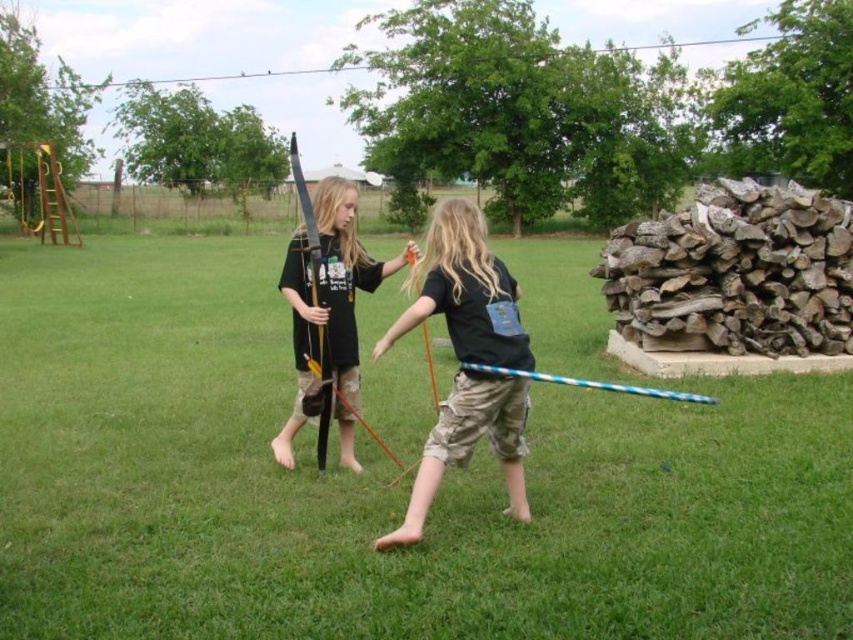
You are a photographer trying to capture a closeup of the matte black bow at center. Given that the green grass at center is in front of the bow, will you need to adjust your camera focus to ensure the bow is sharp?

The green grass at center is larger in size than the matte black bow at center, but since the grass is in front, you will need to adjust your focus to the matte black bow at center to ensure it is sharp.

You are standing at the point labeled as point (x=64, y=563) in the image. A soccer ball is placed exactly at your current position. If you want to kick the ball towards the playground structure with yellow and red components in the background, which direction should you kick the ball?

Since the playground structure with yellow and red components is in the background and the point (x=64, y=563) is your current position, you should kick the ball towards the direction of the playground structure to reach it.

You are a drone operator trying to capture a photo of the children playing in the backyard. The camera is currently focused on the green grass at center. To ensure the children are in frame, should you adjust the camera upwards or downwards based on the grass position?

The green grass at center is located at point coordinates of 0.742 on the x and 0.453 on the y axis. Since the children are positioned closer to the foreground, adjusting the camera upwards would bring them into focus while keeping the grass at center in the frame.